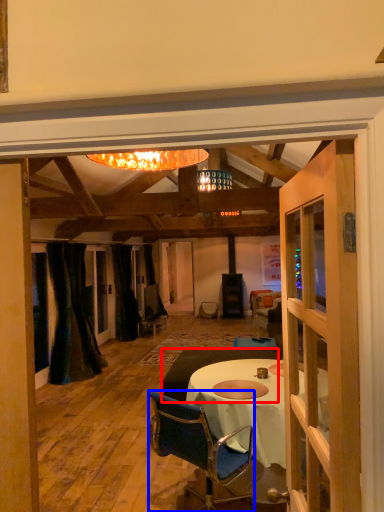
Question: Which object appears farthest to the camera in this image, studio couch (highlighted by a red box) or chair (highlighted by a blue box)?

Choices:
 (A) studio couch
 (B) chair

Answer: (A)